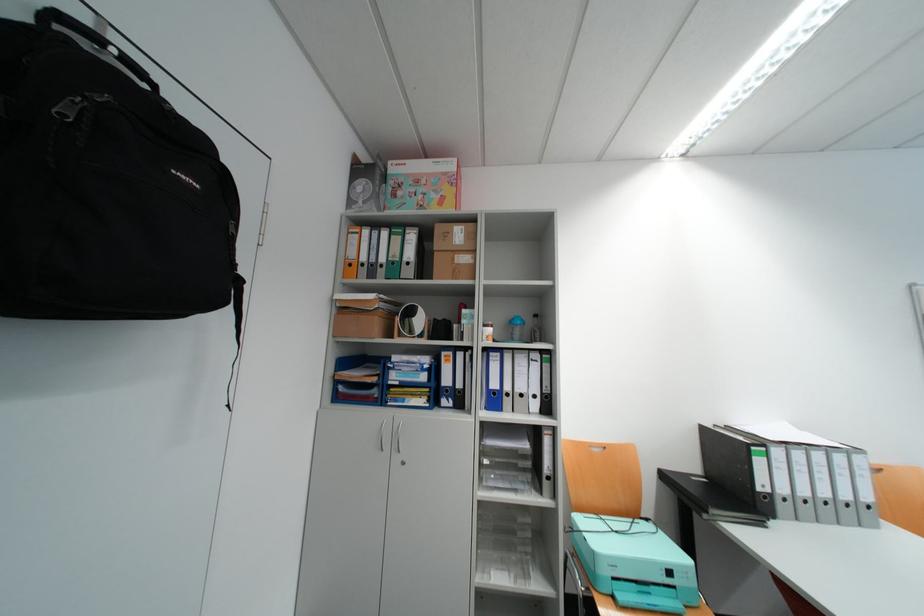
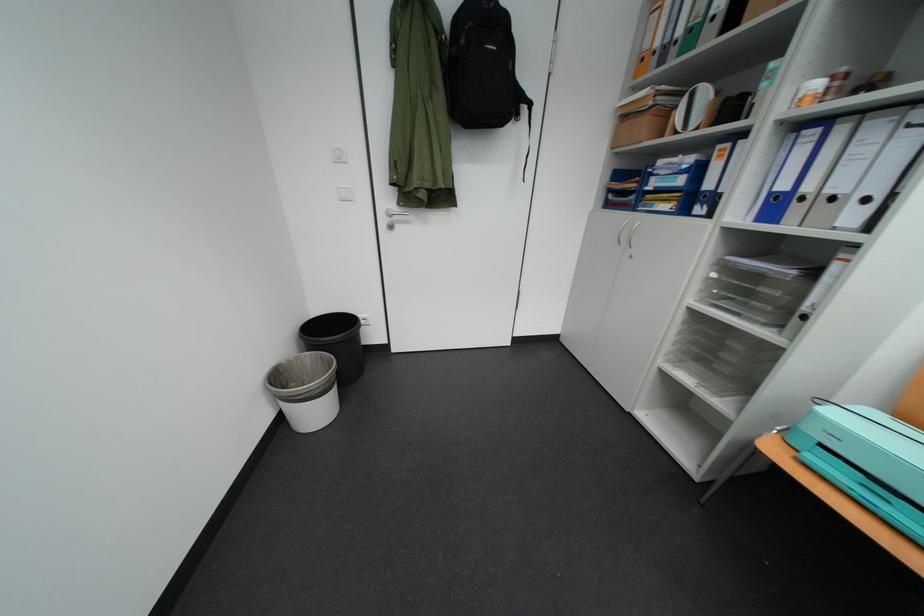
Locate, in the second image, the point that corresponds to (x=497, y=463) in the first image.

(724, 277)